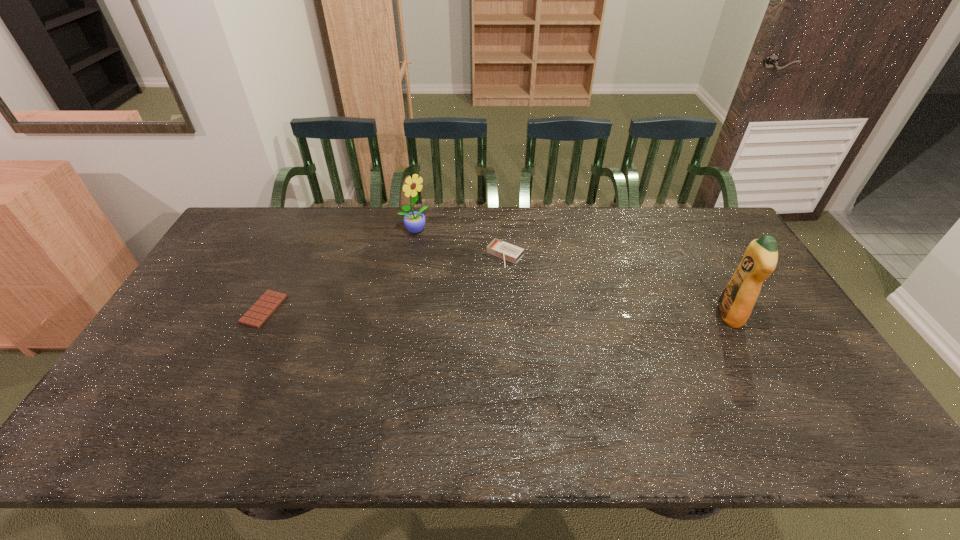
Locate an element on the screen. The width and height of the screenshot is (960, 540). free space between the tallest object and the shortest object is located at coordinates (496, 312).

This screenshot has height=540, width=960. Find the location of `free spot between the third object from right to left and the tallest object`. free spot between the third object from right to left and the tallest object is located at coordinates (572, 273).

Image resolution: width=960 pixels, height=540 pixels. What are the coordinates of `empty space between the second object from right to left and the shortest object` in the screenshot? It's located at (385, 282).

At what (x,y) coordinates should I click in order to perform the action: click on free space between the matchbox and the detergent. Please return your answer as a coordinate pair (x, y). The width and height of the screenshot is (960, 540). Looking at the image, I should click on (617, 285).

The width and height of the screenshot is (960, 540). In order to click on vacant region between the leftmost object and the second object from right to left in this screenshot , I will do `click(385, 282)`.

Where is `object that is the second nearest to the second tallest object`? This screenshot has height=540, width=960. object that is the second nearest to the second tallest object is located at coordinates (270, 300).

Where is `object that is the third closest one to the detergent`? The image size is (960, 540). object that is the third closest one to the detergent is located at coordinates (270, 300).

You are a GUI agent. You are given a task and a screenshot of the screen. Output one action in this format:
    pyautogui.click(x=<x>, y=<y>)
    Task: Click on the vacant space that satisfies the following two spatial constraints: 1. on the front side of the farthest object; 2. on the left side of the third nearest object
    
    Given the screenshot: What is the action you would take?
    pyautogui.click(x=410, y=255)

The height and width of the screenshot is (540, 960). I want to click on vacant area in the image that satisfies the following two spatial constraints: 1. on the front side of the second object from left to right; 2. on the label of the tallest object, so [399, 315].

Find the location of a particular element. vacant space that satisfies the following two spatial constraints: 1. on the front side of the sunflower; 2. on the right side of the third nearest object is located at coordinates (410, 255).